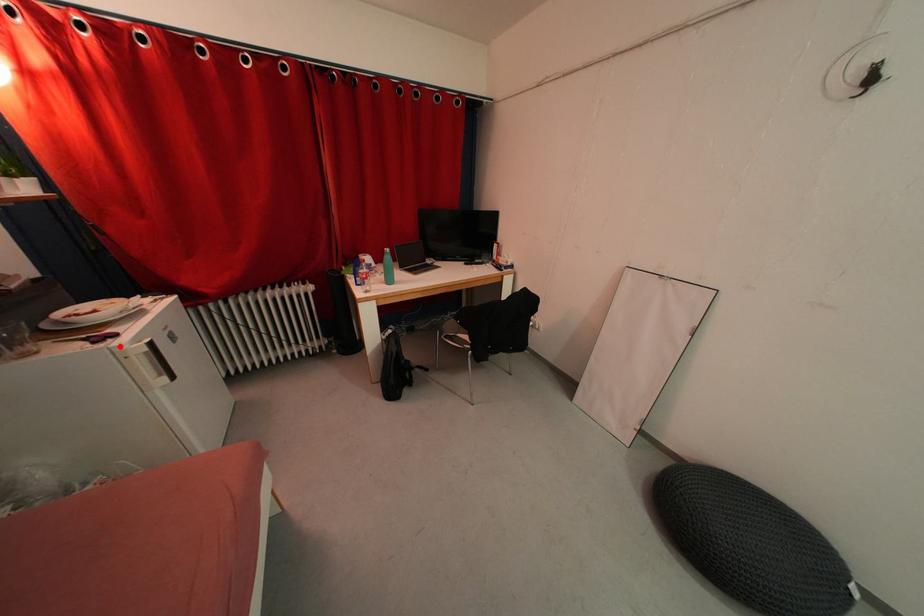
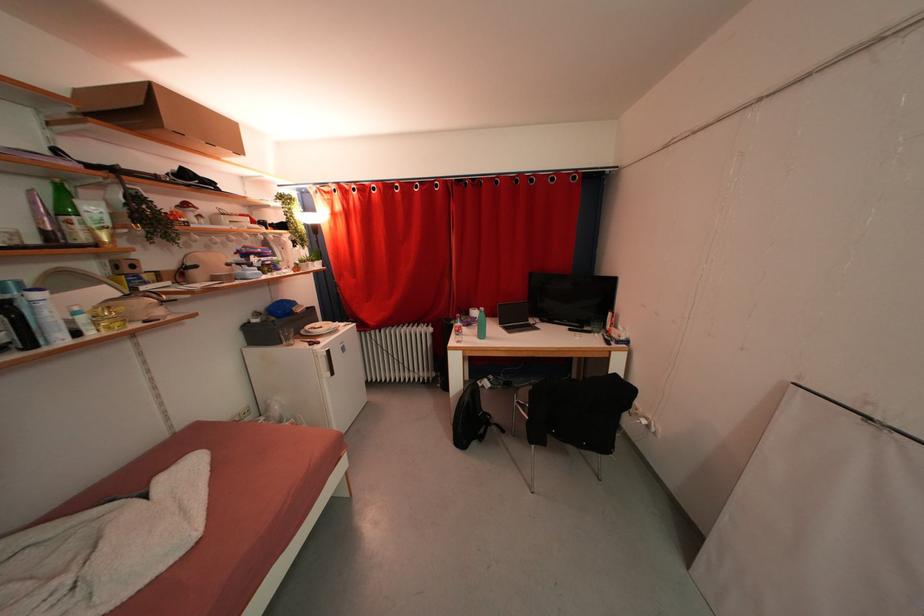
Question: I am providing you with two images of the same scene from different viewpoints. A red point is shown in image1. For the corresponding object point in image2, is it positioned nearer or farther from the camera?

Choices:
 (A) Nearer
 (B) Farther

Answer: (A)